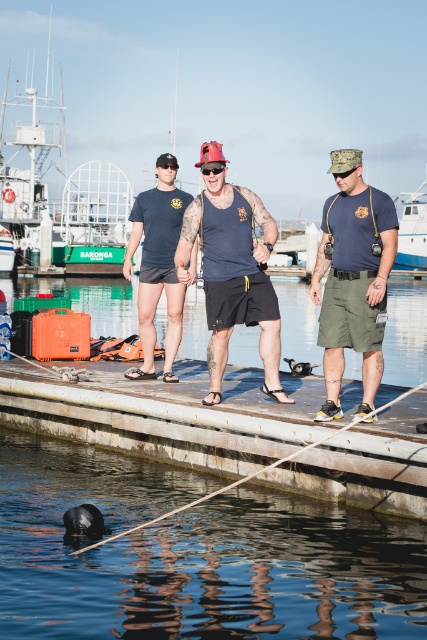
Between matte black shorts at center and white plastic boat at center, which one appears on the left side from the viewer's perspective?

Positioned to the left is matte black shorts at center.

Is point (146, 205) positioned before point (409, 262)?

Yes.

You are a GUI agent. You are given a task and a screenshot of the screen. Output one action in this format:
    pyautogui.click(x=<x>, y=<y>)
    Task: Click on the matte black shorts at center
    The width and height of the screenshot is (427, 640).
    Given the screenshot: What is the action you would take?
    pyautogui.click(x=157, y=266)

Which is below, black rubber buoy at lower left or red reflective plastic goggles at center?

black rubber buoy at lower left is below.

Is point (38, 442) positioned in front of point (222, 164)?

No, it is not.

What are the coordinates of `black rubber buoy at lower left` in the screenshot? It's located at (195, 556).

Where is `black rubber buoy at lower left`? The height and width of the screenshot is (640, 427). black rubber buoy at lower left is located at coordinates (195, 556).

Is point (37, 225) less distant than point (177, 163)?

No, (37, 225) is behind (177, 163).

Which is above, green painted steel boat at upper left or black matte goggles at center?

Positioned higher is green painted steel boat at upper left.

Who is more distant from viewer, (90, 232) or (172, 168)?

Point (90, 232)

At what (x,y) coordinates should I click in order to perform the action: click on green painted steel boat at upper left. Please return your answer as a coordinate pair (x, y). Looking at the image, I should click on (58, 188).